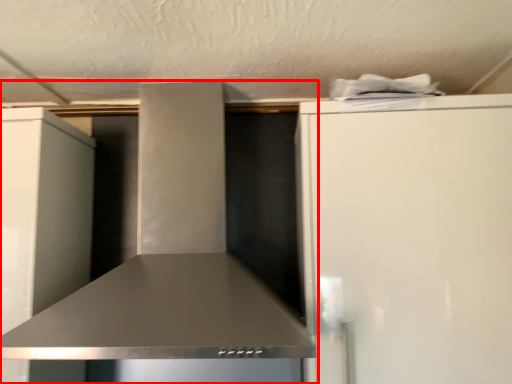
Question: Observing the image, what is the correct spatial positioning of home appliance (annotated by the red box) in reference to refrigerator?

Choices:
 (A) right
 (B) left

Answer: (B)